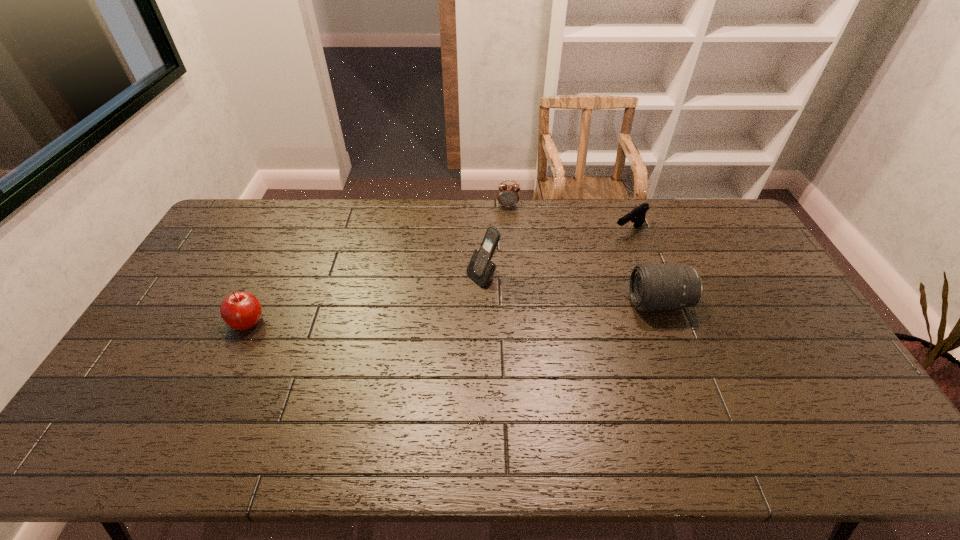
The image size is (960, 540). Identify the location of apple. (241, 310).

At what (x,y) coordinates should I click in order to perform the action: click on telephoto lens. Please return your answer as a coordinate pair (x, y). Looking at the image, I should click on (653, 287).

At what (x,y) coordinates should I click in order to perform the action: click on the farthest object. Please return your answer as a coordinate pair (x, y). This screenshot has height=540, width=960. Looking at the image, I should click on (508, 195).

I want to click on alarm clock, so click(x=508, y=195).

Locate an element on the screen. The image size is (960, 540). the second object from left to right is located at coordinates (481, 268).

At what (x,y) coordinates should I click in order to perform the action: click on the tallest object. Please return your answer as a coordinate pair (x, y). The image size is (960, 540). Looking at the image, I should click on (481, 268).

The width and height of the screenshot is (960, 540). Find the location of `pistol`. pistol is located at coordinates (637, 215).

You are a GUI agent. You are given a task and a screenshot of the screen. Output one action in this format:
    pyautogui.click(x=<x>, y=<y>)
    Task: Click on the fourth nearest object
    Image resolution: width=960 pixels, height=540 pixels.
    Given the screenshot: What is the action you would take?
    pyautogui.click(x=637, y=215)

This screenshot has width=960, height=540. I want to click on vacant space located on the back of the leftmost object, so click(x=272, y=272).

Image resolution: width=960 pixels, height=540 pixels. In order to click on vacant area situated on the surface of the telephoto lens in this screenshot , I will do `click(578, 303)`.